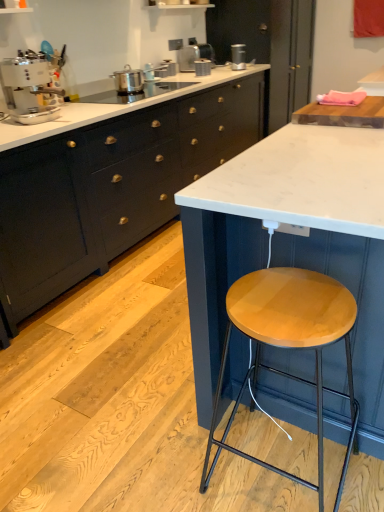
This screenshot has width=384, height=512. What do you see at coordinates (292, 244) in the screenshot? I see `white marble countertop at center, which is counted as the 1th countertop, starting from the bottom` at bounding box center [292, 244].

The width and height of the screenshot is (384, 512). What do you see at coordinates (288, 345) in the screenshot? I see `wooden seat stool at center` at bounding box center [288, 345].

Image resolution: width=384 pixels, height=512 pixels. Describe the element at coordinates (238, 57) in the screenshot. I see `satin silver toaster at upper center, the 1th appliance viewed from the right` at that location.

This screenshot has height=512, width=384. Describe the element at coordinates (202, 67) in the screenshot. I see `metallic silver canister at center, positioned as the 2th appliance in front-to-back order` at that location.

Measure the distance between matte black cabinet at center, acting as the first cabinetry starting from the right, and camera.

matte black cabinet at center, acting as the first cabinetry starting from the right, is 3.91 meters away from camera.

The image size is (384, 512). What are the coordinates of `satin silver toaster at upper center, the third appliance when ordered from front to back` in the screenshot? It's located at (167, 69).

Can you confirm if satin silver toaster at upper center, acting as the 3th appliance starting from the back, is wider than satin silver toaster at upper center, the third appliance when ordered from left to right?

Incorrect, the width of satin silver toaster at upper center, acting as the 3th appliance starting from the back, does not surpass that of satin silver toaster at upper center, the third appliance when ordered from left to right.

Is point (169, 71) positioned before point (185, 54)?

Yes.

Based on the photo, who is taller, satin silver toaster at upper center, acting as the 3th appliance starting from the back, or satin silver toaster at upper center, which ranks as the fifth appliance in front-to-back order?

satin silver toaster at upper center, which ranks as the fifth appliance in front-to-back order.

Is satin silver toaster at upper center, the third appliance ordered from the bottom, not within satin silver toaster at upper center, which ranks as the fifth appliance in front-to-back order?

Yes, satin silver toaster at upper center, the third appliance ordered from the bottom, is outside of satin silver toaster at upper center, which ranks as the fifth appliance in front-to-back order.

How far apart are wooden seat stool at center and satin silver toaster at upper center, the 3th appliance when ordered from top to bottom?

wooden seat stool at center is 3.11 meters away from satin silver toaster at upper center, the 3th appliance when ordered from top to bottom.

Is wooden seat stool at center looking in the opposite direction of satin silver toaster at upper center, which appears as the second appliance when viewed from the left?

wooden seat stool at center is not turned away from satin silver toaster at upper center, which appears as the second appliance when viewed from the left.

Is wooden seat stool at center closer to the viewer compared to satin silver toaster at upper center, the 3th appliance when ordered from top to bottom?

Yes, wooden seat stool at center is closer to the camera.

Can you confirm if wooden seat stool at center is wider than satin silver toaster at upper center, acting as the 3th appliance starting from the back?

Correct, the width of wooden seat stool at center exceeds that of satin silver toaster at upper center, acting as the 3th appliance starting from the back.

Is the position of wooden seat stool at center less distant than that of satin silver toaster at upper center, which ranks as the third appliance in right-to-left order?

Yes.

Considering the positions of objects wooden seat stool at center and satin silver toaster at upper center, which ranks as the fifth appliance in front-to-back order, in the image provided, who is more to the right, wooden seat stool at center or satin silver toaster at upper center, which ranks as the fifth appliance in front-to-back order,?

Positioned to the right is wooden seat stool at center.

Is wooden seat stool at center thinner than satin silver toaster at upper center, which ranks as the fifth appliance in front-to-back order?

No.

Could you tell me if wooden seat stool at center is facing satin silver toaster at upper center, acting as the fifth appliance starting from the bottom?

No.

Considering the positions of objects satin silver toaster at upper center, which ranks as the fifth appliance in front-to-back order, and metallic silver canister at center, acting as the 4th appliance starting from the left, in the image provided, who is behind, satin silver toaster at upper center, which ranks as the fifth appliance in front-to-back order, or metallic silver canister at center, acting as the 4th appliance starting from the left,?

satin silver toaster at upper center, which ranks as the fifth appliance in front-to-back order, is further away from the camera.

Considering the relative sizes of satin silver toaster at upper center, the third appliance when ordered from left to right, and metallic silver canister at center, the 4th appliance in the back-to-front sequence, in the image provided, is satin silver toaster at upper center, the third appliance when ordered from left to right, smaller than metallic silver canister at center, the 4th appliance in the back-to-front sequence,?

No.

From the image's perspective, is satin silver toaster at upper center, which appears as the first appliance when viewed from the top, on metallic silver canister at center, positioned as the 2th appliance in front-to-back order?

Yes, from the image's perspective, satin silver toaster at upper center, which appears as the first appliance when viewed from the top, is above metallic silver canister at center, positioned as the 2th appliance in front-to-back order.

Based on the photo, how far apart are satin silver toaster at upper center, which ranks as the third appliance in right-to-left order, and metallic silver canister at center, which ranks as the 2th appliance in bottom-to-top order?

satin silver toaster at upper center, which ranks as the third appliance in right-to-left order, and metallic silver canister at center, which ranks as the 2th appliance in bottom-to-top order, are 8.82 centimeters apart.

Can you see satin silver toaster at upper center, which is counted as the 4th appliance, starting from the front, touching wooden cutting board at upper right, the 2th countertop positioned from the bottom?

No, satin silver toaster at upper center, which is counted as the 4th appliance, starting from the front, is not in contact with wooden cutting board at upper right, the 2th countertop positioned from the bottom.

Considering the sizes of satin silver toaster at upper center, which is counted as the 4th appliance, starting from the front, and wooden cutting board at upper right, which is the 1th countertop in top-to-bottom order, in the image, is satin silver toaster at upper center, which is counted as the 4th appliance, starting from the front, bigger or smaller than wooden cutting board at upper right, which is the 1th countertop in top-to-bottom order,?

Considering their sizes, satin silver toaster at upper center, which is counted as the 4th appliance, starting from the front, takes up less space than wooden cutting board at upper right, which is the 1th countertop in top-to-bottom order.

Which appliance is the 4th one when counting from the back of the wooden cutting board at upper right, the 2th countertop positioned from the bottom? Please provide its 2D coordinates.

[(238, 57)]

Is metallic silver canister at center, which ranks as the 2th appliance in bottom-to-top order, at the back of satin silver toaster at upper center, the 1th appliance viewed from the right?

No, satin silver toaster at upper center, the 1th appliance viewed from the right,'s orientation is not away from metallic silver canister at center, which ranks as the 2th appliance in bottom-to-top order.

Is satin silver toaster at upper center, the second appliance from the top, positioned beyond the bounds of metallic silver canister at center, positioned as the 2th appliance in front-to-back order?

That's correct, satin silver toaster at upper center, the second appliance from the top, is outside of metallic silver canister at center, positioned as the 2th appliance in front-to-back order.

In terms of size, does satin silver toaster at upper center, the 1th appliance viewed from the right, appear bigger or smaller than metallic silver canister at center, marked as the 4th appliance in a top-to-bottom arrangement?

Considering their sizes, satin silver toaster at upper center, the 1th appliance viewed from the right, takes up more space than metallic silver canister at center, marked as the 4th appliance in a top-to-bottom arrangement.

In the image, is satin silver toaster at upper center, the second appliance from the top, positioned in front of or behind metallic silver canister at center, the 4th appliance in the back-to-front sequence?

In the image, satin silver toaster at upper center, the second appliance from the top, appears behind metallic silver canister at center, the 4th appliance in the back-to-front sequence.

How many degrees apart are the facing directions of matte black cabinets at center, positioned as the 2th cabinetry in right-to-left order, and wooden seat stool at center?

There is a 88.7-degree angle between the facing directions of matte black cabinets at center, positioned as the 2th cabinetry in right-to-left order, and wooden seat stool at center.

In the scene shown: In the image, is matte black cabinets at center, positioned as the 2th cabinetry in right-to-left order, positioned in front of or behind wooden seat stool at center?

matte black cabinets at center, positioned as the 2th cabinetry in right-to-left order, is behind wooden seat stool at center.

Is matte black cabinets at center, positioned as the 2th cabinetry in right-to-left order, not near wooden seat stool at center?

Yes, matte black cabinets at center, positioned as the 2th cabinetry in right-to-left order, and wooden seat stool at center are quite far apart.

This screenshot has height=512, width=384. Find the location of `the 3rd appliance above the satin silver toaster at upper center, acting as the 3th appliance starting from the back (from a real-world perspective)`. the 3rd appliance above the satin silver toaster at upper center, acting as the 3th appliance starting from the back (from a real-world perspective) is located at coordinates (194, 55).

In the image, there is a satin silver toaster at upper center, which appears as the second appliance when viewed from the left. Where is `stool below it (from a real-world perspective)`? This screenshot has height=512, width=384. stool below it (from a real-world perspective) is located at coordinates (288, 345).

Looking at the image, which one is located closer to satin silver toaster at upper center, which is counted as the 1th appliance, starting from the back, satin silver toaster at upper center, acting as the 3th appliance starting from the back, or white marble countertop at center, which ranks as the 2th countertop in top-to-bottom order?

satin silver toaster at upper center, acting as the 3th appliance starting from the back, is closer to satin silver toaster at upper center, which is counted as the 1th appliance, starting from the back.

Estimate the real-world distances between objects in this image. Which object is closer to satin silver toaster at upper center, the 1th appliance viewed from the right, matte black cabinet at center, the second cabinetry positioned from the left, or metallic silver canister at center, which ranks as the 2th appliance in bottom-to-top order?

Based on the image, metallic silver canister at center, which ranks as the 2th appliance in bottom-to-top order, appears to be nearer to satin silver toaster at upper center, the 1th appliance viewed from the right.

Based on their spatial positions, is white glossy coffee machine at upper left, which appears as the 5th appliance when viewed from the top, or satin silver toaster at upper center, which appears as the 2th appliance when viewed from the back, closer to matte black cabinet at center, the second cabinetry positioned from the left?

satin silver toaster at upper center, which appears as the 2th appliance when viewed from the back.

Estimate the real-world distances between objects in this image. Which object is closer to wooden seat stool at center, satin silver toaster at upper center, which is counted as the 1th appliance, starting from the back, or wooden cutting board at upper right, the 2th countertop positioned from the bottom?

Based on the image, wooden cutting board at upper right, the 2th countertop positioned from the bottom, appears to be nearer to wooden seat stool at center.

Considering their positions, is satin silver toaster at upper center, acting as the fourth appliance starting from the bottom, positioned closer to white marble countertop at center, which ranks as the 2th countertop in top-to-bottom order, than white glossy coffee machine at upper left, acting as the 5th appliance starting from the back?

white glossy coffee machine at upper left, acting as the 5th appliance starting from the back, is positioned closer to the anchor white marble countertop at center, which ranks as the 2th countertop in top-to-bottom order.

Looking at the image, which one is located further to white marble countertop at center, which ranks as the 2th countertop in top-to-bottom order, satin silver toaster at upper center, which appears as the 2th appliance when viewed from the back, or wooden seat stool at center?

Among the two, satin silver toaster at upper center, which appears as the 2th appliance when viewed from the back, is located further to white marble countertop at center, which ranks as the 2th countertop in top-to-bottom order.

Estimate the real-world distances between objects in this image. Which object is closer to satin silver toaster at upper center, which appears as the 2th appliance when viewed from the back, white glossy coffee machine at upper left, acting as the 5th appliance starting from the back, or satin silver toaster at upper center, which appears as the second appliance when viewed from the left?

satin silver toaster at upper center, which appears as the second appliance when viewed from the left.

Which object lies nearer to the anchor point wooden seat stool at center, matte black cabinets at center, the first cabinetry viewed from the left, or satin silver toaster at upper center, which appears as the second appliance when viewed from the left?

matte black cabinets at center, the first cabinetry viewed from the left, is positioned closer to the anchor wooden seat stool at center.

The height and width of the screenshot is (512, 384). I want to click on cabinetry located between white glossy coffee machine at upper left, which appears as the 5th appliance when viewed from the top, and wooden cutting board at upper right, which is the 1th countertop in top-to-bottom order, in the left-right direction, so click(x=110, y=188).

In order to click on countertop between wooden cutting board at upper right, the 2th countertop positioned from the bottom, and wooden seat stool at center from top to bottom in this screenshot , I will do `click(292, 244)`.

Find the location of a particular element. cabinetry positioned between wooden seat stool at center and matte black cabinet at center, the second cabinetry positioned from the left, from near to far is located at coordinates (110, 188).

What are the coordinates of `stool situated between white glossy coffee machine at upper left, marked as the first appliance in a left-to-right arrangement, and white marble countertop at center, which is counted as the 1th countertop, starting from the bottom, from left to right` in the screenshot? It's located at (288, 345).